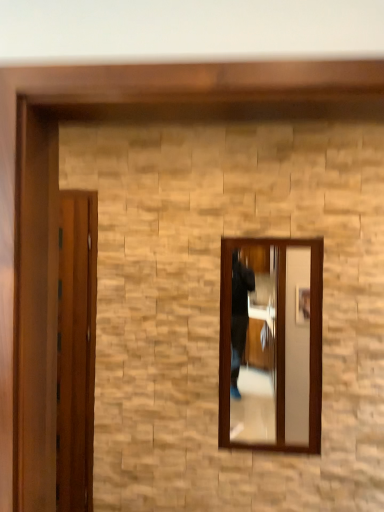
Question: From the image's perspective, is clear glass mirror at center located above wooden door at left?

Choices:
 (A) no
 (B) yes

Answer: (B)

Question: Does clear glass mirror at center have a lesser height compared to wooden door at left?

Choices:
 (A) no
 (B) yes

Answer: (B)

Question: Is clear glass mirror at center in front of wooden door at left?

Choices:
 (A) yes
 (B) no

Answer: (A)

Question: From a real-world perspective, is clear glass mirror at center beneath wooden door at left?

Choices:
 (A) yes
 (B) no

Answer: (B)

Question: Considering the relative sizes of clear glass mirror at center and wooden door at left in the image provided, is clear glass mirror at center taller than wooden door at left?

Choices:
 (A) no
 (B) yes

Answer: (A)

Question: Does clear glass mirror at center have a larger size compared to wooden door at left?

Choices:
 (A) yes
 (B) no

Answer: (A)

Question: From a real-world perspective, is wooden door at left positioned over clear glass mirror at center based on gravity?

Choices:
 (A) no
 (B) yes

Answer: (A)

Question: Is wooden door at left aimed at clear glass mirror at center?

Choices:
 (A) no
 (B) yes

Answer: (A)

Question: From the image's perspective, would you say wooden door at left is shown under clear glass mirror at center?

Choices:
 (A) yes
 (B) no

Answer: (A)

Question: Can we say wooden door at left lies outside clear glass mirror at center?

Choices:
 (A) no
 (B) yes

Answer: (B)

Question: Considering the relative positions of wooden door at left and clear glass mirror at center in the image provided, is wooden door at left to the right of clear glass mirror at center from the viewer's perspective?

Choices:
 (A) yes
 (B) no

Answer: (B)

Question: Can you confirm if wooden door at left is bigger than clear glass mirror at center?

Choices:
 (A) yes
 (B) no

Answer: (B)

Question: Does point (264, 354) appear closer or farther from the camera than point (82, 415)?

Choices:
 (A) farther
 (B) closer

Answer: (A)